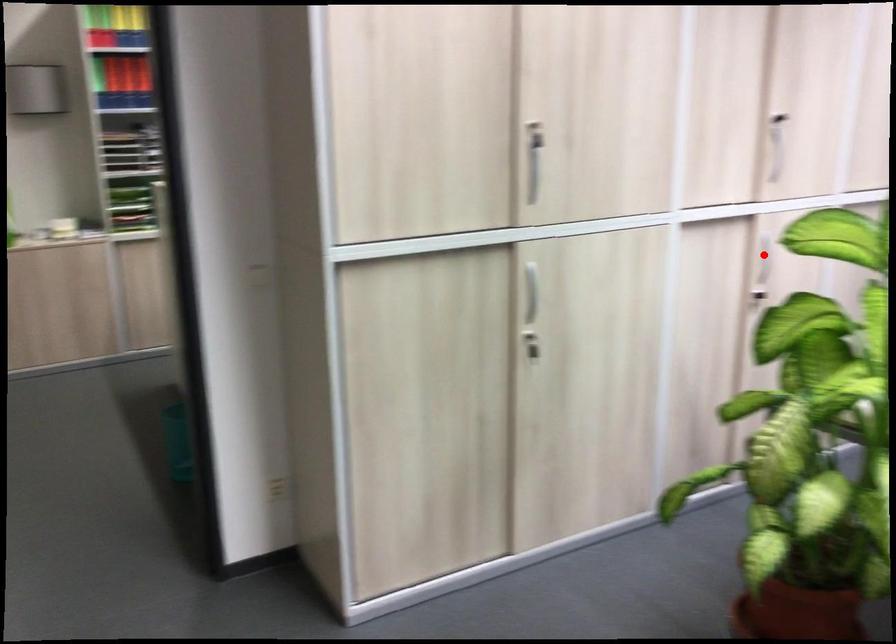
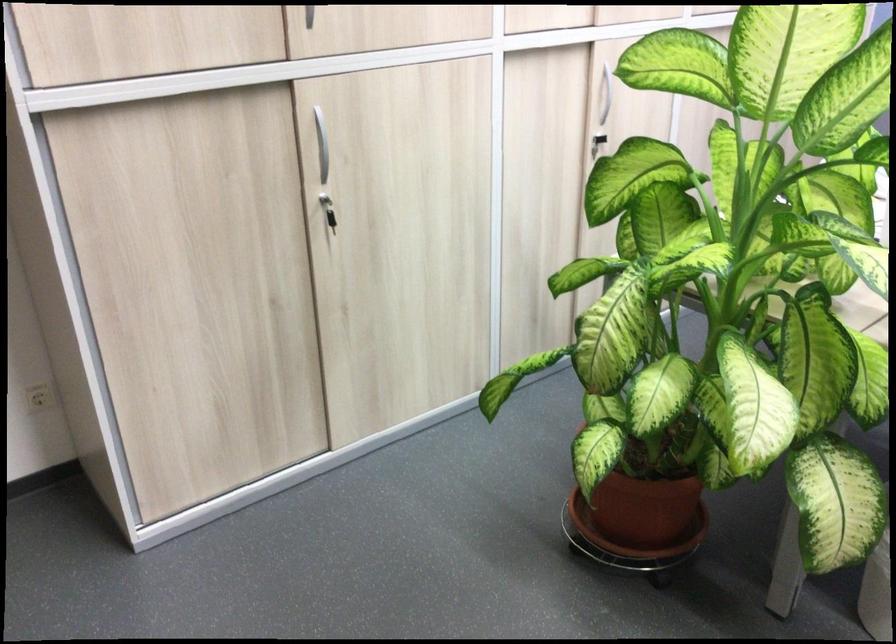
Where in the second image is the point corresponding to the highlighted location from the first image?

(606, 90)